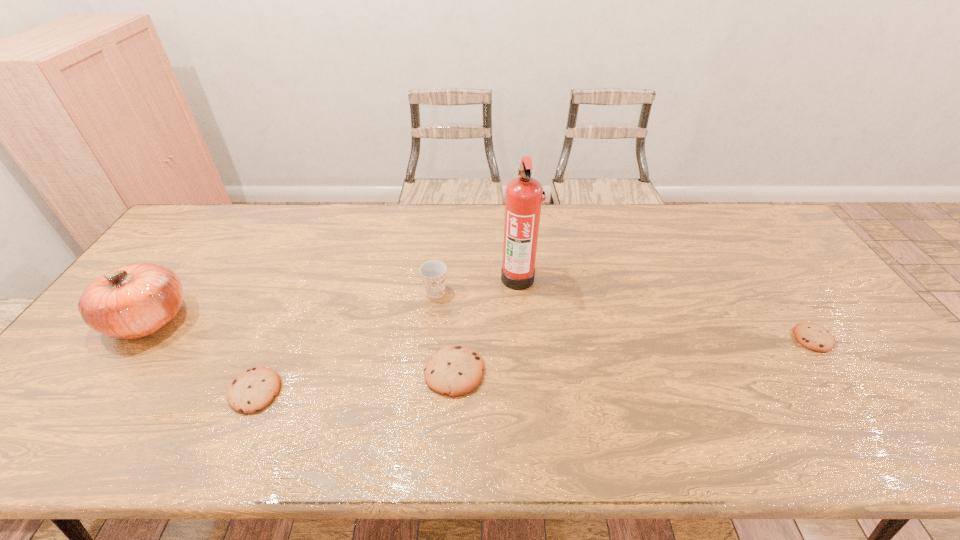
To make them evenly spaced by inserting another cookie among them, please locate a free space for this new cookie. Please provide its 2D coordinates. Your answer should be formatted as a tuple, i.e. [(x, y)], where the tuple contains the x and y coordinates of a point satisfying the conditions above.

[(640, 355)]